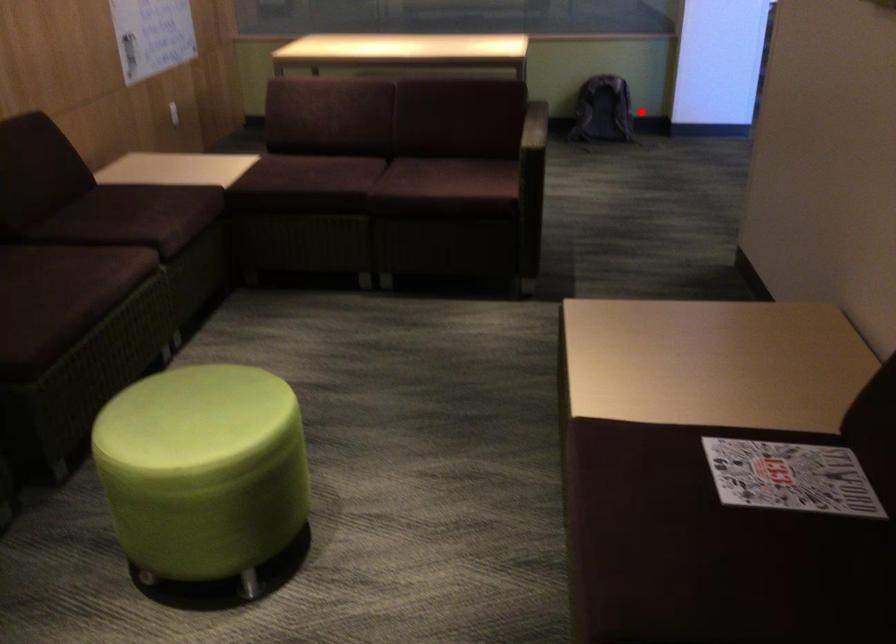
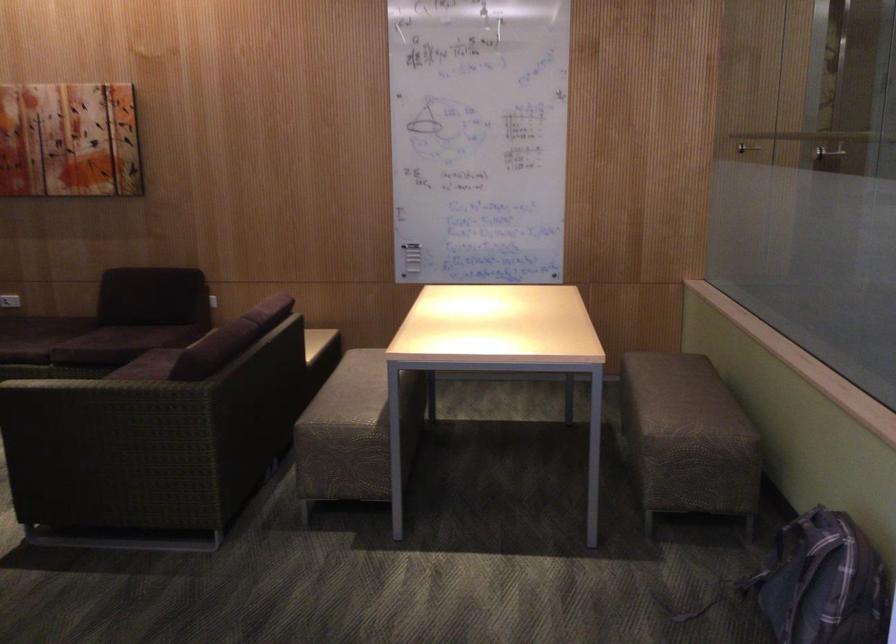
Question: I am providing you with two images of the same scene from different viewpoints. In image1, a red point is highlighted. Considering the same 3D point in image2, which of the following is correct?

Choices:
 (A) It is closer
 (B) It is farther

Answer: (A)